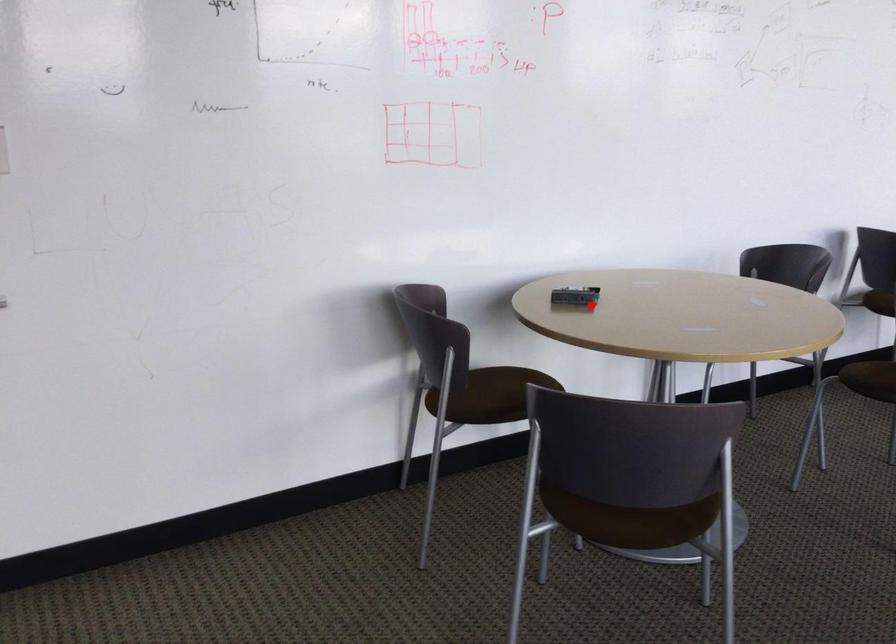
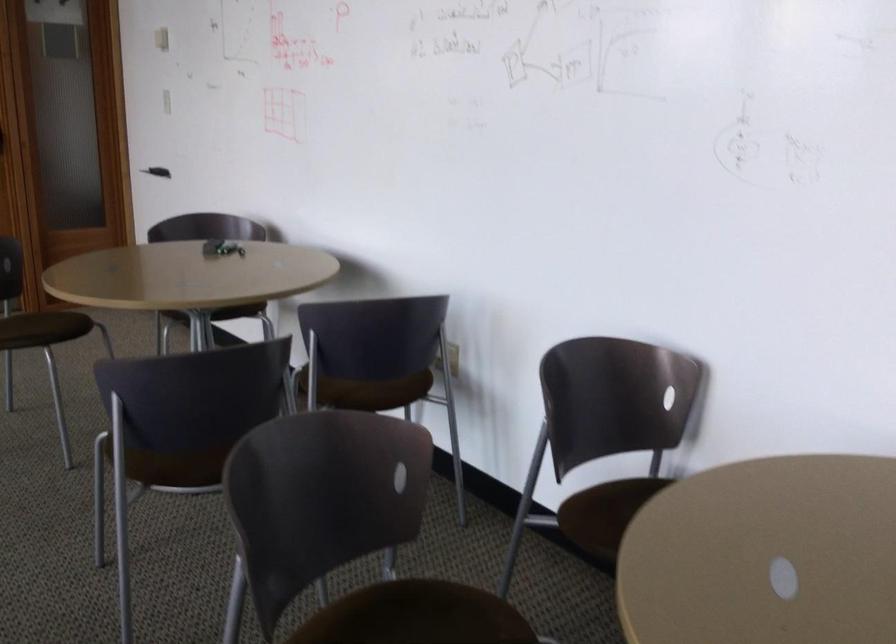
Find the pixel in the second image that matches the highlighted location in the first image.

(221, 248)